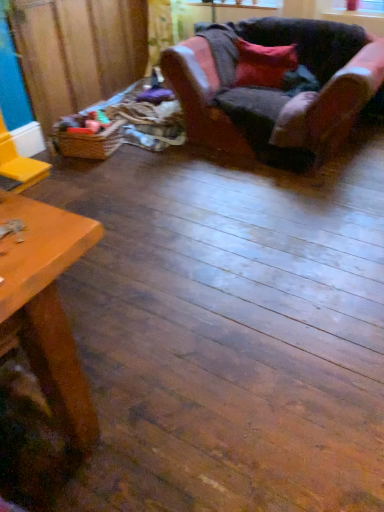
Question: Is velvet red pillow at upper right spatially inside velvet-like pink armchair at upper right, or outside of it?

Choices:
 (A) inside
 (B) outside

Answer: (A)

Question: Is point (268, 50) positioned closer to the camera than point (337, 32)?

Choices:
 (A) closer
 (B) farther

Answer: (B)

Question: Considering the real-world distances, which object is closest to the transparent plastic window screen at upper center?

Choices:
 (A) velvet-like pink armchair at upper right
 (B) brown woven basket at left
 (C) velvet red pillow at upper right
 (D) woven brown basket at left

Answer: (C)

Question: Which object is positioned closest to the brown woven basket at left?

Choices:
 (A) woven brown basket at left
 (B) velvet-like pink armchair at upper right
 (C) velvet red pillow at upper right
 (D) transparent plastic window screen at upper center

Answer: (A)